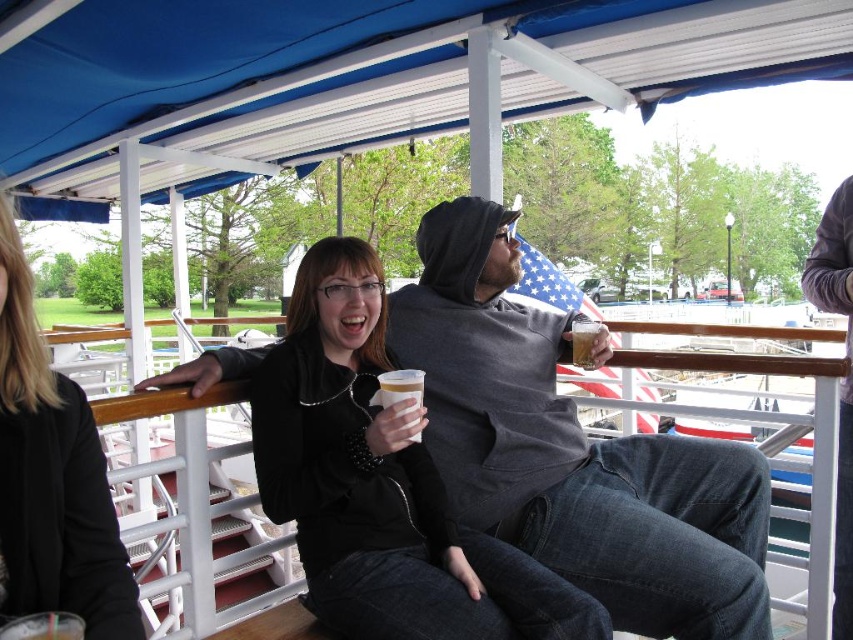
Is dark gray hoodie at center positioned before translucent plastic cup at upper center?

Yes, it is in front of translucent plastic cup at upper center.

Which of these two, dark gray hoodie at center or translucent plastic cup at upper center, stands taller?

dark gray hoodie at center

The height and width of the screenshot is (640, 853). In order to click on dark gray hoodie at center in this screenshot , I will do `click(572, 451)`.

This screenshot has width=853, height=640. I want to click on dark gray hoodie at center, so click(572, 451).

Which of these two, dark gray hoodie at upper right or white plastic cup at center, stands taller?

dark gray hoodie at upper right is taller.

Which is more to the right, dark gray hoodie at upper right or white plastic cup at center?

dark gray hoodie at upper right

You are a GUI agent. You are given a task and a screenshot of the screen. Output one action in this format:
    pyautogui.click(x=<x>, y=<y>)
    Task: Click on the dark gray hoodie at upper right
    
    Given the screenshot: What is the action you would take?
    pyautogui.click(x=844, y=378)

Locate an element on the screen. This screenshot has width=853, height=640. dark gray hoodie at upper right is located at coordinates pos(844,378).

Image resolution: width=853 pixels, height=640 pixels. What do you see at coordinates (380, 483) in the screenshot?
I see `black matte jacket at center` at bounding box center [380, 483].

Which of these two, black matte jacket at center or dark gray hoodie at upper right, stands taller?

dark gray hoodie at upper right

Between point (309, 566) and point (839, 202), which one is positioned behind?

The point (839, 202) is behind.

The height and width of the screenshot is (640, 853). I want to click on black matte jacket at center, so click(x=380, y=483).